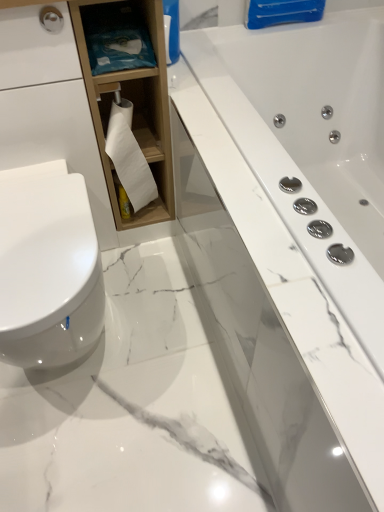
Question: In the image, is white matte toilet paper at center positioned in front of or behind white marble bathtub at center?

Choices:
 (A) behind
 (B) front

Answer: (A)

Question: Considering the positions of point (137, 202) and point (322, 411), is point (137, 202) closer or farther from the camera than point (322, 411)?

Choices:
 (A) farther
 (B) closer

Answer: (A)

Question: Which of these objects is positioned farthest from the white marble bathtub at center?

Choices:
 (A) blue fabric at upper left
 (B) wooden cabinet at left
 (C) white matte toilet paper at center
 (D) white glossy toilet at left

Answer: (D)

Question: Which of these objects is positioned farthest from the wooden cabinet at left?

Choices:
 (A) white glossy toilet at left
 (B) blue fabric at upper left
 (C) white marble bathtub at center
 (D) white matte toilet paper at center

Answer: (A)